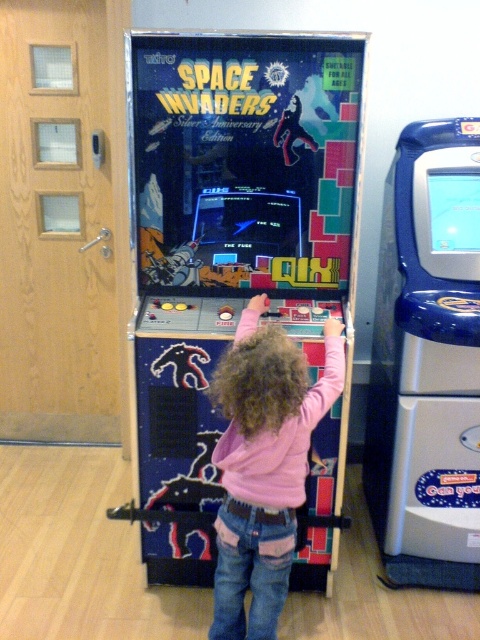
Is blue plastic vending machine at right to the right of pink fleece at center from the viewer's perspective?

Yes, blue plastic vending machine at right is to the right of pink fleece at center.

Looking at this image, can you confirm if blue plastic vending machine at right is taller than pink fleece at center?

Indeed, blue plastic vending machine at right has a greater height compared to pink fleece at center.

Who is more distant from viewer, (371, 364) or (271, 480)?

Positioned behind is point (371, 364).

Find the location of `blue plastic vending machine at right`. blue plastic vending machine at right is located at coordinates (428, 362).